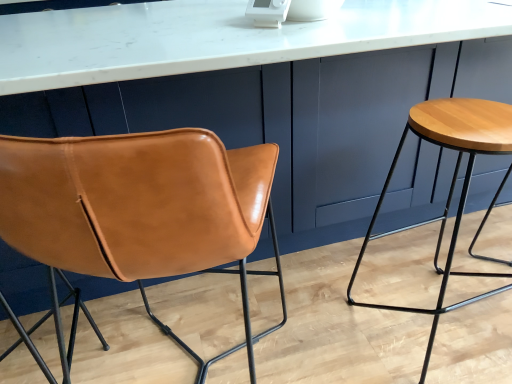
Question: From the image's perspective, would you say white marble countertop at center is shown under wooden stool at right?

Choices:
 (A) no
 (B) yes

Answer: (A)

Question: Is white marble countertop at center positioned behind wooden stool at right?

Choices:
 (A) no
 (B) yes

Answer: (A)

Question: Is white marble countertop at center bigger than wooden stool at right?

Choices:
 (A) yes
 (B) no

Answer: (A)

Question: Is white marble countertop at center closer to camera compared to wooden stool at right?

Choices:
 (A) no
 (B) yes

Answer: (B)

Question: Is white marble countertop at center facing towards wooden stool at right?

Choices:
 (A) yes
 (B) no

Answer: (A)

Question: From the image's perspective, is white marble countertop at center positioned above or below wooden stool at right?

Choices:
 (A) below
 (B) above

Answer: (B)

Question: From their relative heights in the image, would you say white marble countertop at center is taller or shorter than wooden stool at right?

Choices:
 (A) short
 (B) tall

Answer: (B)

Question: Would you say white marble countertop at center is to the left or to the right of wooden stool at right in the picture?

Choices:
 (A) left
 (B) right

Answer: (A)

Question: Is point (24, 41) closer or farther from the camera than point (436, 266)?

Choices:
 (A) closer
 (B) farther

Answer: (A)

Question: Is wooden stool at right wider or thinner than cognac leather chair at left?

Choices:
 (A) thin
 (B) wide

Answer: (A)

Question: Visually, is wooden stool at right positioned to the left or to the right of cognac leather chair at left?

Choices:
 (A) left
 (B) right

Answer: (B)

Question: From their relative heights in the image, would you say wooden stool at right is taller or shorter than cognac leather chair at left?

Choices:
 (A) short
 (B) tall

Answer: (A)

Question: From the image's perspective, is wooden stool at right located above or below cognac leather chair at left?

Choices:
 (A) above
 (B) below

Answer: (A)

Question: Considering the positions of cognac leather chair at left and wooden stool at right in the image, is cognac leather chair at left taller or shorter than wooden stool at right?

Choices:
 (A) tall
 (B) short

Answer: (A)

Question: From a real-world perspective, is cognac leather chair at left above or below wooden stool at right?

Choices:
 (A) above
 (B) below

Answer: (A)